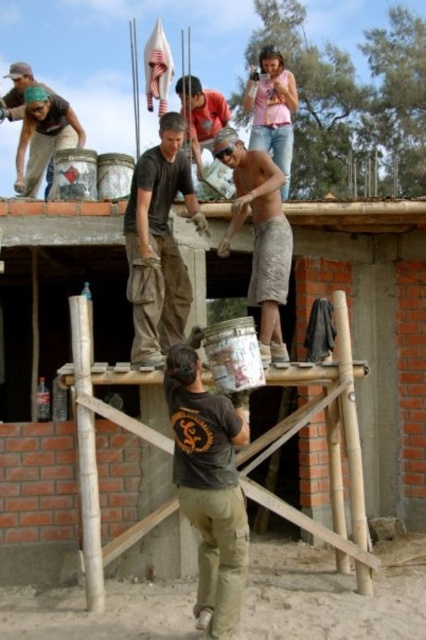
In the scene shown: You are a construction worker who needs to pass through the narrow space between the camouflage fabric shorts at center and the matte gray shirt at center on the scaffolding. Given that your body is 0.5 meters wide, can you fit through the space between them?

The camouflage fabric shorts at center is wider than the matte gray shirt at center. However, without specific measurements of the space between them, it is impossible to determine if the 0.5 meters width will fit. The description only compares their widths, not the distance between them.